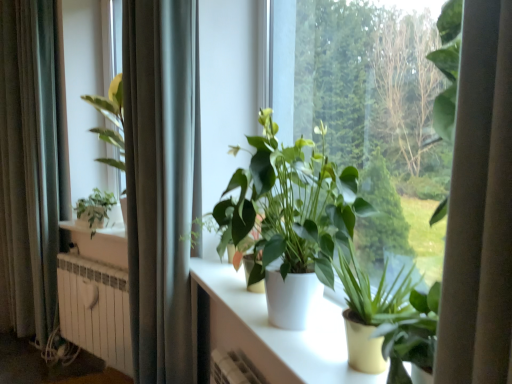
Question: Is white matte plant pot at center, which is counted as the second houseplant, starting from the right, oriented towards green matte plant at left, marked as the third houseplant in a right-to-left arrangement?

Choices:
 (A) no
 (B) yes

Answer: (A)

Question: Is white matte plant pot at center, positioned as the 2th houseplant in left-to-right order, positioned beyond the bounds of green matte plant at left, marked as the third houseplant in a right-to-left arrangement?

Choices:
 (A) yes
 (B) no

Answer: (A)

Question: From a real-world perspective, does white matte plant pot at center, the second houseplant from the back, stand above green matte plant at left, the 3th houseplant positioned from the front?

Choices:
 (A) yes
 (B) no

Answer: (A)

Question: Considering the relative sizes of white matte plant pot at center, which is counted as the second houseplant, starting from the right, and green matte plant at left, which is the first houseplant from left to right, in the image provided, is white matte plant pot at center, which is counted as the second houseplant, starting from the right, thinner than green matte plant at left, which is the first houseplant from left to right,?

Choices:
 (A) no
 (B) yes

Answer: (A)

Question: Does white matte plant pot at center, positioned as the 2th houseplant in left-to-right order, touch green matte plant at left, the 3th houseplant positioned from the front?

Choices:
 (A) yes
 (B) no

Answer: (B)

Question: Is white matte plant pot at center, which is counted as the second houseplant, starting from the right, to the right of green matte plant at left, which is the first houseplant from left to right, from the viewer's perspective?

Choices:
 (A) no
 (B) yes

Answer: (B)

Question: Is white metallic radiator at lower left oriented away from white matte plant pot at center, positioned as the 2th houseplant in left-to-right order?

Choices:
 (A) no
 (B) yes

Answer: (A)

Question: From a real-world perspective, is white metallic radiator at lower left below white matte plant pot at center, the second houseplant from the back?

Choices:
 (A) no
 (B) yes

Answer: (B)

Question: Is white metallic radiator at lower left positioned in front of white matte plant pot at center, which appears as the 2th houseplant when viewed from the front?

Choices:
 (A) yes
 (B) no

Answer: (B)

Question: Does white metallic radiator at lower left appear on the right side of white matte plant pot at center, positioned as the 2th houseplant in left-to-right order?

Choices:
 (A) no
 (B) yes

Answer: (A)

Question: Would you consider white metallic radiator at lower left to be distant from white matte plant pot at center, the second houseplant from the back?

Choices:
 (A) yes
 (B) no

Answer: (A)

Question: From a real-world perspective, is white metallic radiator at lower left physically above white matte plant pot at center, which is counted as the second houseplant, starting from the right?

Choices:
 (A) no
 (B) yes

Answer: (A)

Question: Is silky gray curtain at left, which ranks as the 1th curtain in left-to-right order, not within green matte plant at center, which is the 3th houseplant from left to right?

Choices:
 (A) yes
 (B) no

Answer: (A)